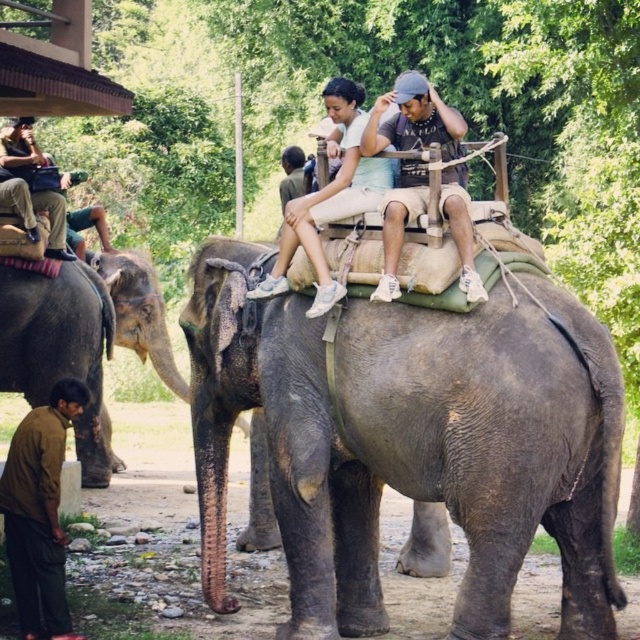
Question: Which object is positioned closest to the brown cotton shirt at lower left?

Choices:
 (A) dark gray fabric hat at upper center
 (B) gray textured elephant at lower left
 (C) matte brown pants at left

Answer: (A)

Question: Which object is the farthest from the dark gray fabric hat at upper center?

Choices:
 (A) matte brown pants at left
 (B) gray textured elephant at lower left
 (C) brown cotton shirt at lower left
 (D) gray matte elephant at center

Answer: (B)

Question: From the image, what is the correct spatial relationship of gray textured elephant at lower left in relation to matte brown pants at left?

Choices:
 (A) above
 (B) below

Answer: (B)

Question: Is gray matte elephant at center above dark gray fabric hat at upper center?

Choices:
 (A) yes
 (B) no

Answer: (B)

Question: Which of the following is the closest to the observer?

Choices:
 (A) (163, 333)
 (B) (10, 518)

Answer: (B)

Question: Is gray matte elephant at center positioned before brown cotton shirt at lower left?

Choices:
 (A) no
 (B) yes

Answer: (B)